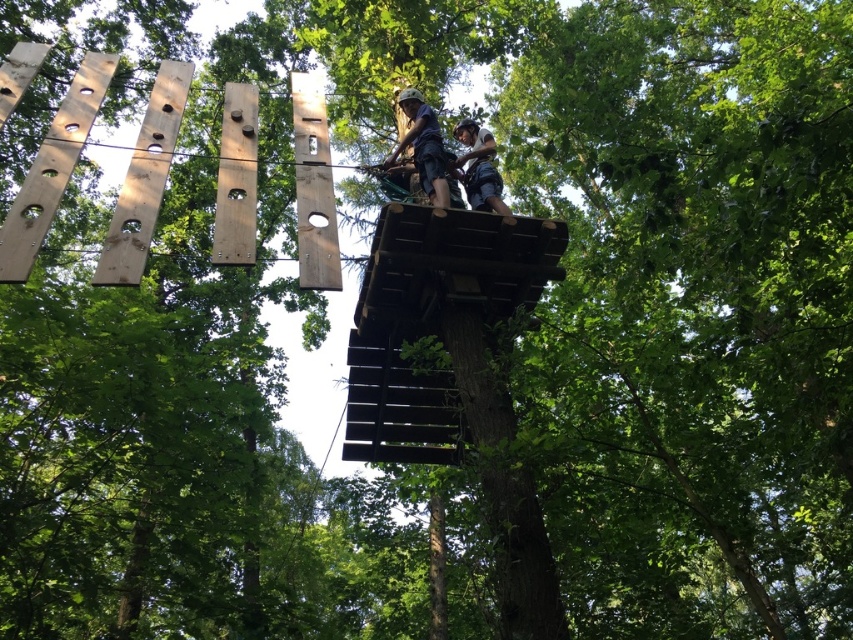
You are an adventure guide assessing safety equipment on a tree platform. You notice the matte blue helmet at upper center and the dark blue fabric harness at upper center. Which piece of equipment is bigger in size?

The matte blue helmet at upper center has a larger size compared to the dark blue fabric harness at upper center.

You are a safety inspector checking equipment dimensions. The matte blue helmet at upper center must have a minimum width of 20 cm to meet safety standards. Can you confirm if it meets this requirement based on the dark blue fabric harness at upper center?

The matte blue helmet at upper center has a larger width than the dark blue fabric harness at upper center. Since the harness is not mentioned to have a specific width, we cannot confirm if the helmet meets the 20 cm requirement.

You are a safety inspector checking the equipment on the wooden platform. You notice the matte blue helmet at upper center and the dark blue fabric harness at upper center. Which piece of equipment is closer to you?

The matte blue helmet at upper center is closer to you because it is further to the viewer than the dark blue fabric harness at upper center.